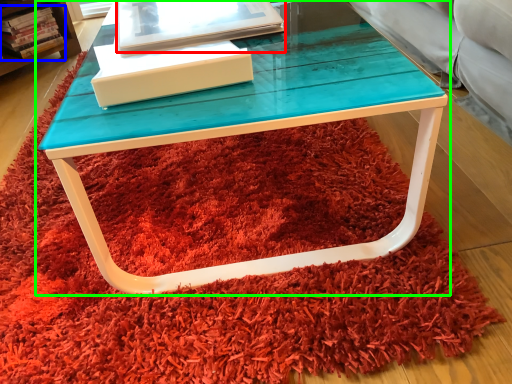
Question: Estimate the real-world distances between objects in this image. Which object is farther from book (highlighted by a red box), book (highlighted by a blue box) or table (highlighted by a green box)?

Choices:
 (A) book
 (B) table

Answer: (A)